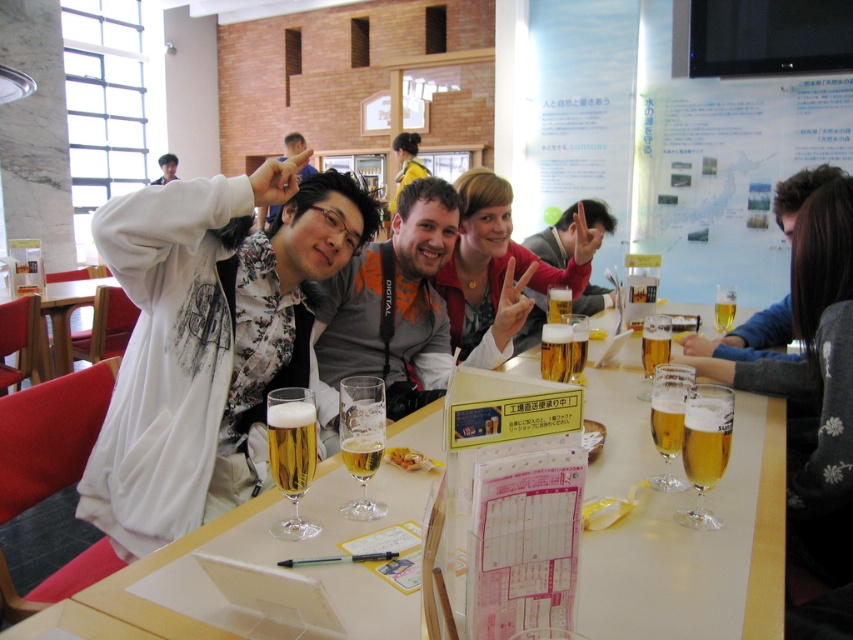
Question: Which of the following is the farthest from the observer?

Choices:
 (A) (56, 289)
 (B) (416, 353)
 (C) (587, 307)

Answer: (A)

Question: Does translucent glass table at center have a larger size compared to wooden table at center?

Choices:
 (A) yes
 (B) no

Answer: (A)

Question: Can you confirm if wooden table at center is bigger than translucent glass beer at center?

Choices:
 (A) yes
 (B) no

Answer: (A)

Question: Based on their relative distances, which object is farther from the matte gray jacket at center?

Choices:
 (A) golden glass beer at center
 (B) translucent glass table at center
 (C) matte white jacket at center

Answer: (A)

Question: Estimate the real-world distances between objects in this image. Which object is farther from the matte black hair at upper left?

Choices:
 (A) translucent glass beer at center
 (B) matte gray sweater at center
 (C) matte gray jacket at center
 (D) translucent glass table at center

Answer: (A)

Question: Is translucent glass table at center in front of translucent glass beer at center?

Choices:
 (A) yes
 (B) no

Answer: (A)